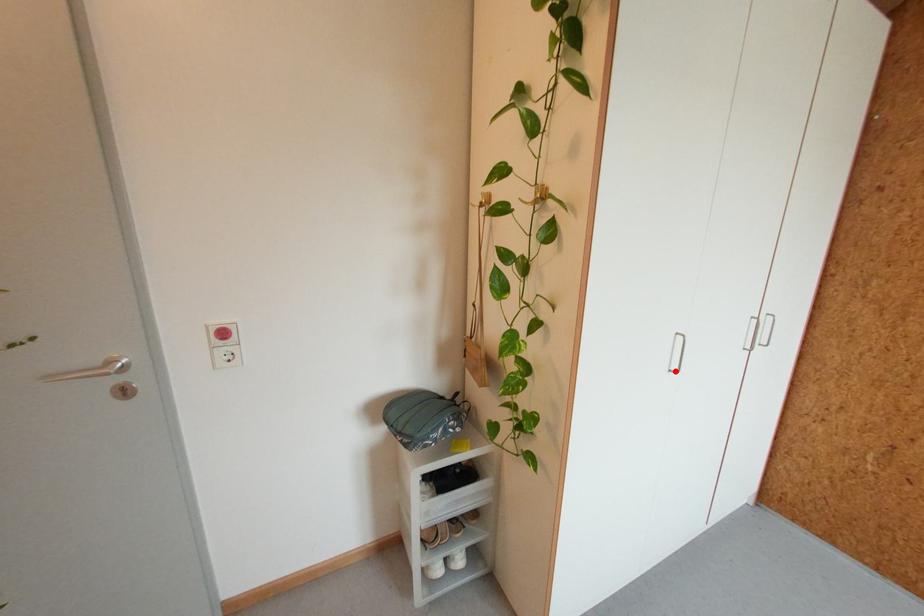
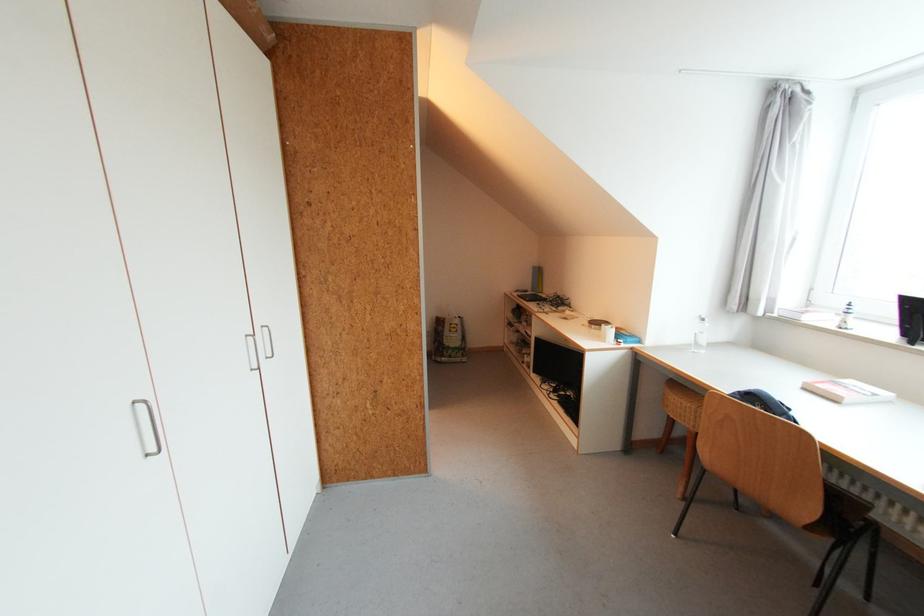
Find the pixel in the second image that matches the highlighted location in the first image.

(152, 456)